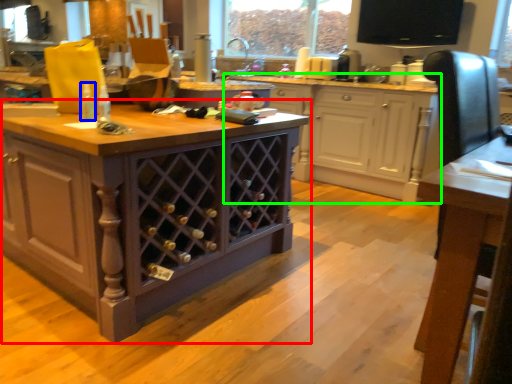
Question: Based on their relative distances, which object is nearer to cabinetry (highlighted by a red box)? Choose from bottle (highlighted by a blue box) and cabinetry (highlighted by a green box).

Choices:
 (A) bottle
 (B) cabinetry

Answer: (A)